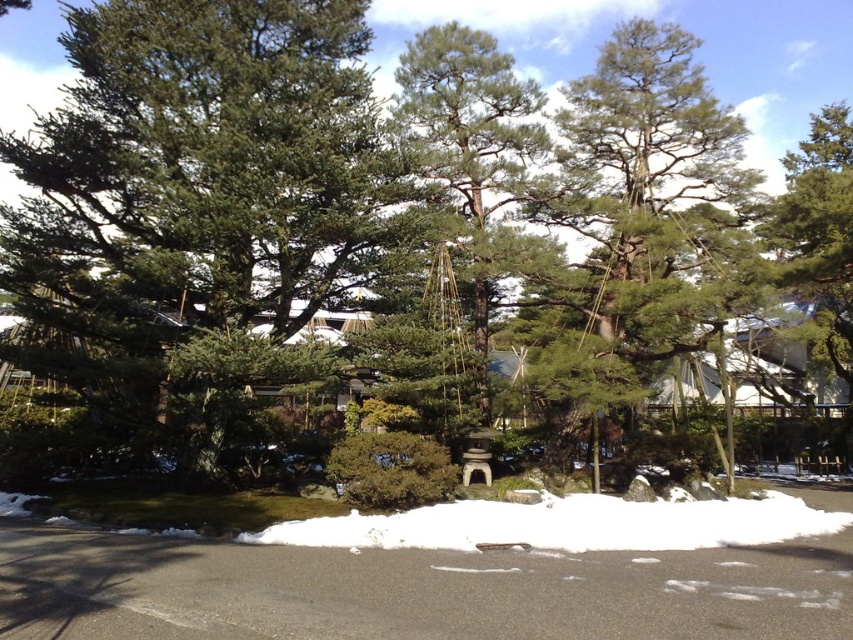
You are a visitor in the garden and want to take a photo of both the green matte tree at center and the green textured tree at center. Since you have a camera with a limited depth of field, which tree should you focus on to ensure both are in focus?

To ensure both the green matte tree at center and the green textured tree at center are in focus, you should focus on the green matte tree at center since it is closer to you and the green textured tree at center is behind it.